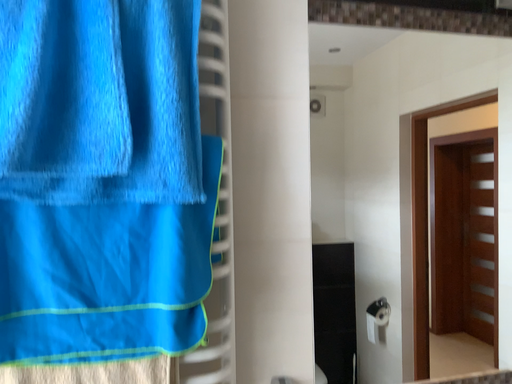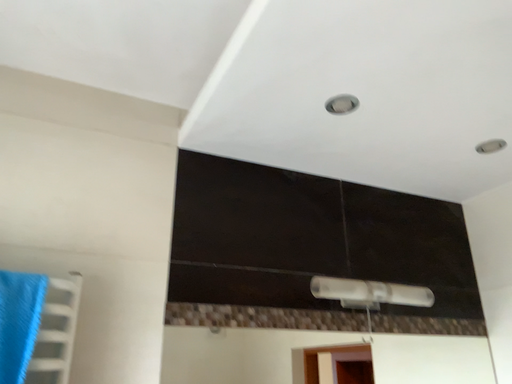
Question: How did the camera likely rotate when shooting the video?

Choices:
 (A) rotated downward
 (B) rotated upward

Answer: (B)